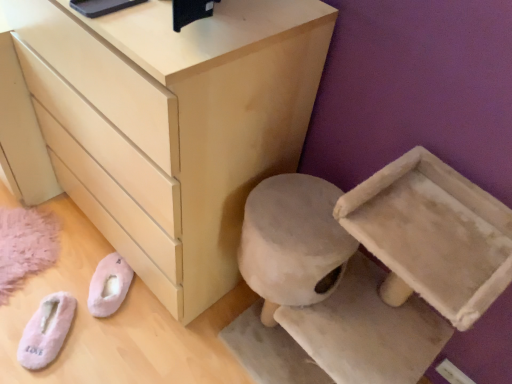
You are a GUI agent. You are given a task and a screenshot of the screen. Output one action in this format:
    pyautogui.click(x=<x>, y=<y>)
    Task: Click on the pink fuzzy slippers at lower left, the 1th footwear from the right
    Image resolution: width=512 pixels, height=384 pixels.
    Given the screenshot: What is the action you would take?
    pyautogui.click(x=109, y=285)

Considering the positions of objects pink fuzzy slippers at lower left, the second footwear when ordered from left to right, and pink fluffy slippers at lower left, which is counted as the second footwear, starting from the right, in the image provided, who is more to the left, pink fuzzy slippers at lower left, the second footwear when ordered from left to right, or pink fluffy slippers at lower left, which is counted as the second footwear, starting from the right,?

Positioned to the left is pink fluffy slippers at lower left, which is counted as the second footwear, starting from the right.

The image size is (512, 384). I want to click on footwear that is in front of the pink fuzzy slippers at lower left, the second footwear when ordered from left to right, so click(46, 331).

Is pink fuzzy slippers at lower left, the 1th footwear from the right, situated inside pink fluffy slippers at lower left, which ranks as the first footwear in left-to-right order, or outside?

pink fuzzy slippers at lower left, the 1th footwear from the right, is outside pink fluffy slippers at lower left, which ranks as the first footwear in left-to-right order.

Is pink fluffy slippers at lower left, which ranks as the first footwear in left-to-right order, touching pink fuzzy slippers at lower left, the 1th footwear from the right?

No, pink fluffy slippers at lower left, which ranks as the first footwear in left-to-right order, is not touching pink fuzzy slippers at lower left, the 1th footwear from the right.

Looking at this image, could you tell me if pink fluffy slippers at lower left, which ranks as the first footwear in left-to-right order, is facing pink fuzzy slippers at lower left, the 1th footwear from the right?

No, pink fluffy slippers at lower left, which ranks as the first footwear in left-to-right order, is not aimed at pink fuzzy slippers at lower left, the 1th footwear from the right.

Can you confirm if pink fluffy slippers at lower left, which ranks as the first footwear in left-to-right order, is taller than pink fuzzy slippers at lower left, the second footwear when ordered from left to right?

No.

Is pink fluffy slippers at lower left, which is counted as the second footwear, starting from the right, thinner than pink fuzzy slippers at lower left, the second footwear when ordered from left to right?

Yes.

Considering the relative sizes of matte light wood chest of drawers at center and pink fluffy slippers at lower left, which is counted as the second footwear, starting from the right, in the image provided, is matte light wood chest of drawers at center thinner than pink fluffy slippers at lower left, which is counted as the second footwear, starting from the right,?

Incorrect, the width of matte light wood chest of drawers at center is not less than that of pink fluffy slippers at lower left, which is counted as the second footwear, starting from the right.

From the image's perspective, is matte light wood chest of drawers at center above or below pink fluffy slippers at lower left, which is counted as the second footwear, starting from the right?

matte light wood chest of drawers at center is above pink fluffy slippers at lower left, which is counted as the second footwear, starting from the right.

From a real-world perspective, is matte light wood chest of drawers at center positioned above or below pink fluffy slippers at lower left, which ranks as the first footwear in left-to-right order?

In terms of real-world spatial position, matte light wood chest of drawers at center is above pink fluffy slippers at lower left, which ranks as the first footwear in left-to-right order.

Between matte light wood chest of drawers at center and pink fluffy slippers at lower left, which ranks as the first footwear in left-to-right order, which one is positioned in front?

matte light wood chest of drawers at center.

Which object is more forward, matte light wood chest of drawers at center or pink fuzzy slippers at lower left, the second footwear when ordered from left to right?

Positioned in front is matte light wood chest of drawers at center.

From a real-world perspective, is matte light wood chest of drawers at center positioned under pink fuzzy slippers at lower left, the 1th footwear from the right, based on gravity?

Incorrect, from a real-world perspective, matte light wood chest of drawers at center is higher than pink fuzzy slippers at lower left, the 1th footwear from the right.

Considering the relative sizes of matte light wood chest of drawers at center and pink fuzzy slippers at lower left, the 1th footwear from the right, in the image provided, is matte light wood chest of drawers at center taller than pink fuzzy slippers at lower left, the 1th footwear from the right,?

Correct, matte light wood chest of drawers at center is much taller as pink fuzzy slippers at lower left, the 1th footwear from the right.

Based on the photo, is pink fuzzy slippers at lower left, the 1th footwear from the right, bigger or smaller than matte light wood chest of drawers at center?

pink fuzzy slippers at lower left, the 1th footwear from the right, is smaller than matte light wood chest of drawers at center.

Looking at this image, is pink fuzzy slippers at lower left, the second footwear when ordered from left to right, facing towards matte light wood chest of drawers at center?

No, pink fuzzy slippers at lower left, the second footwear when ordered from left to right, does not turn towards matte light wood chest of drawers at center.

Could matte light wood chest of drawers at center be considered to be inside pink fuzzy slippers at lower left, the second footwear when ordered from left to right?

No, matte light wood chest of drawers at center is not a part of pink fuzzy slippers at lower left, the second footwear when ordered from left to right.

Which is further, (110,264) or (230,72)?

Point (110,264)

From the image's perspective, which object appears higher, pink fluffy slippers at lower left, which ranks as the first footwear in left-to-right order, or matte light wood chest of drawers at center?

matte light wood chest of drawers at center.

What's the angular difference between pink fluffy slippers at lower left, which ranks as the first footwear in left-to-right order, and matte light wood chest of drawers at center's facing directions?

pink fluffy slippers at lower left, which ranks as the first footwear in left-to-right order, and matte light wood chest of drawers at center are facing 41.2 degrees away from each other.

Is matte light wood chest of drawers at center at the back of pink fluffy slippers at lower left, which ranks as the first footwear in left-to-right order?

Yes, matte light wood chest of drawers at center is at the back of pink fluffy slippers at lower left, which ranks as the first footwear in left-to-right order.

Image resolution: width=512 pixels, height=384 pixels. In order to click on footwear on the left of pink fuzzy slippers at lower left, the 1th footwear from the right in this screenshot , I will do `click(46, 331)`.

I want to click on footwear below the pink fuzzy slippers at lower left, the 1th footwear from the right (from the image's perspective), so click(46, 331).

Looking at the image, which one is located further to pink fuzzy slippers at lower left, the 1th footwear from the right, pink fluffy slippers at lower left, which ranks as the first footwear in left-to-right order, or matte light wood chest of drawers at center?

matte light wood chest of drawers at center is further to pink fuzzy slippers at lower left, the 1th footwear from the right.

Which object lies nearer to the anchor point pink fluffy slippers at lower left, which ranks as the first footwear in left-to-right order, matte light wood chest of drawers at center or pink fuzzy slippers at lower left, the second footwear when ordered from left to right?

Among the two, pink fuzzy slippers at lower left, the second footwear when ordered from left to right, is located nearer to pink fluffy slippers at lower left, which ranks as the first footwear in left-to-right order.

When comparing their distances from pink fuzzy slippers at lower left, the 1th footwear from the right, does matte light wood chest of drawers at center or pink fluffy slippers at lower left, which ranks as the first footwear in left-to-right order, seem further?

The object further to pink fuzzy slippers at lower left, the 1th footwear from the right, is matte light wood chest of drawers at center.

From the picture: When comparing their distances from pink fluffy slippers at lower left, which ranks as the first footwear in left-to-right order, does pink fuzzy slippers at lower left, the 1th footwear from the right, or matte light wood chest of drawers at center seem closer?

pink fuzzy slippers at lower left, the 1th footwear from the right, is positioned closer to the anchor pink fluffy slippers at lower left, which ranks as the first footwear in left-to-right order.

Estimate the real-world distances between objects in this image. Which object is closer to matte light wood chest of drawers at center, pink fluffy slippers at lower left, which is counted as the second footwear, starting from the right, or pink fuzzy slippers at lower left, the 1th footwear from the right?

The object closer to matte light wood chest of drawers at center is pink fuzzy slippers at lower left, the 1th footwear from the right.

Based on their spatial positions, is pink fuzzy slippers at lower left, the second footwear when ordered from left to right, or pink fluffy slippers at lower left, which ranks as the first footwear in left-to-right order, further from matte light wood chest of drawers at center?

Based on the image, pink fluffy slippers at lower left, which ranks as the first footwear in left-to-right order, appears to be further to matte light wood chest of drawers at center.

This screenshot has width=512, height=384. What are the coordinates of `footwear between matte light wood chest of drawers at center and pink fuzzy slippers at lower left, the 1th footwear from the right, in the front-back direction` in the screenshot? It's located at (46, 331).